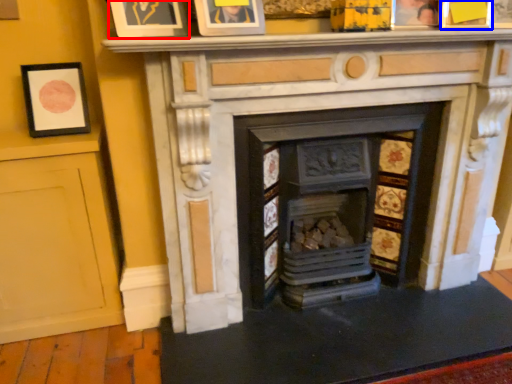
Question: Which point is further to the camera, picture frame (highlighted by a red box) or picture frame (highlighted by a blue box)?

Choices:
 (A) picture frame
 (B) picture frame

Answer: (B)